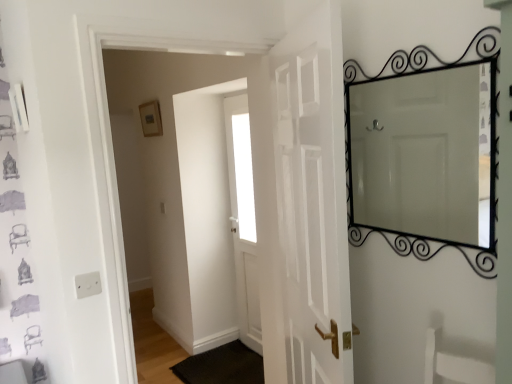
Question: In which direction should I rotate to look at white glossy door at center, the first door in the front-to-back sequence?

Choices:
 (A) left
 (B) right

Answer: (B)

Question: Does black wrought iron mirror at upper right have a lesser height compared to white glossy door at center, the first door in the front-to-back sequence?

Choices:
 (A) yes
 (B) no

Answer: (A)

Question: Is black wrought iron mirror at upper right positioned beyond the bounds of white glossy door at center, the first door in the front-to-back sequence?

Choices:
 (A) no
 (B) yes

Answer: (B)

Question: Are black wrought iron mirror at upper right and white glossy door at center, the first door in the front-to-back sequence, making contact?

Choices:
 (A) no
 (B) yes

Answer: (A)

Question: Is black wrought iron mirror at upper right bigger than white glossy door at center, positioned as the second door in back-to-front order?

Choices:
 (A) no
 (B) yes

Answer: (A)

Question: From the image's perspective, is black wrought iron mirror at upper right located beneath white glossy door at center, the first door in the front-to-back sequence?

Choices:
 (A) no
 (B) yes

Answer: (A)

Question: Is the position of black wrought iron mirror at upper right more distant than that of white glossy door at center, positioned as the second door in back-to-front order?

Choices:
 (A) no
 (B) yes

Answer: (B)

Question: Can you confirm if white glossy door at center, the first door in the front-to-back sequence, is smaller than white matte door at center, the first door in the back-to-front sequence?

Choices:
 (A) no
 (B) yes

Answer: (A)

Question: Is white matte door at center, the first door in the back-to-front sequence, a part of white glossy door at center, positioned as the second door in back-to-front order?

Choices:
 (A) yes
 (B) no

Answer: (B)

Question: Considering the relative positions of white glossy door at center, the first door in the front-to-back sequence, and white matte door at center, arranged as the 2th door when viewed from the front, in the image provided, is white glossy door at center, the first door in the front-to-back sequence, to the right of white matte door at center, arranged as the 2th door when viewed from the front, from the viewer's perspective?

Choices:
 (A) no
 (B) yes

Answer: (B)

Question: From the image's perspective, does white glossy door at center, the first door in the front-to-back sequence, appear lower than white matte door at center, arranged as the 2th door when viewed from the front?

Choices:
 (A) yes
 (B) no

Answer: (B)

Question: Is white glossy door at center, positioned as the second door in back-to-front order, to the left of white matte door at center, the first door in the back-to-front sequence, from the viewer's perspective?

Choices:
 (A) yes
 (B) no

Answer: (B)

Question: Considering the relative sizes of white glossy door at center, positioned as the second door in back-to-front order, and white matte door at center, the first door in the back-to-front sequence, in the image provided, is white glossy door at center, positioned as the second door in back-to-front order, thinner than white matte door at center, the first door in the back-to-front sequence,?

Choices:
 (A) no
 (B) yes

Answer: (A)

Question: Can you confirm if black rubber doormat at lower center is bigger than white glossy door at center, the first door in the front-to-back sequence?

Choices:
 (A) no
 (B) yes

Answer: (A)